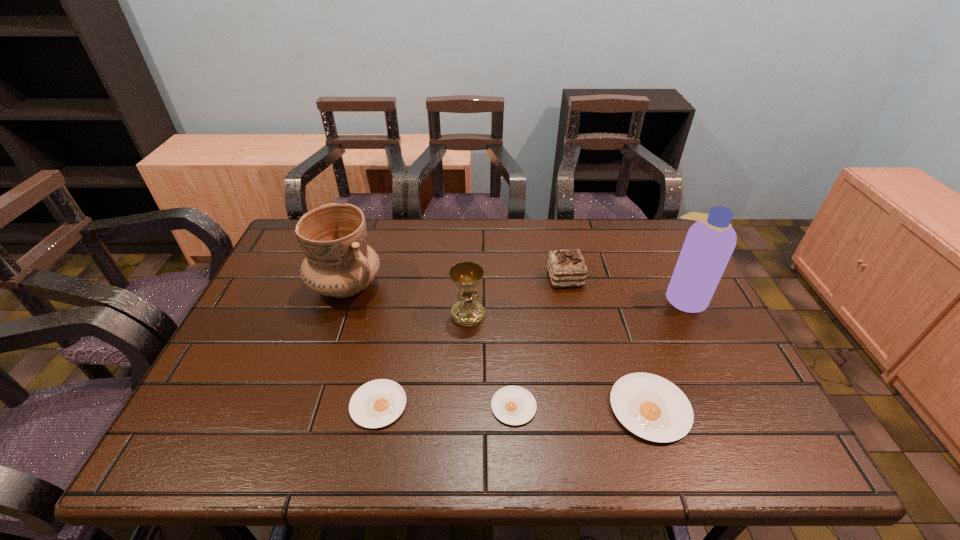
At what (x,y) coordinates should I click in order to perform the action: click on the second shortest object. Please return your answer as a coordinate pair (x, y). This screenshot has width=960, height=540. Looking at the image, I should click on (377, 403).

This screenshot has width=960, height=540. In order to click on the second tallest egg yolk in this screenshot , I will do `click(377, 403)`.

I want to click on the shortest object, so click(513, 405).

In order to click on the fourth object from right to left in this screenshot , I will do `click(513, 405)`.

Locate an element on the screen. The image size is (960, 540). the third shortest object is located at coordinates (653, 408).

Where is `the rightmost egg yolk`? the rightmost egg yolk is located at coordinates (653, 408).

This screenshot has width=960, height=540. Identify the location of the tallest object. (710, 242).

Find the location of a particular element. the rightmost object is located at coordinates (710, 242).

The image size is (960, 540). In order to click on the fifth shortest object in this screenshot , I will do `click(466, 276)`.

Locate an element on the screen. the fifth object from right to left is located at coordinates (466, 276).